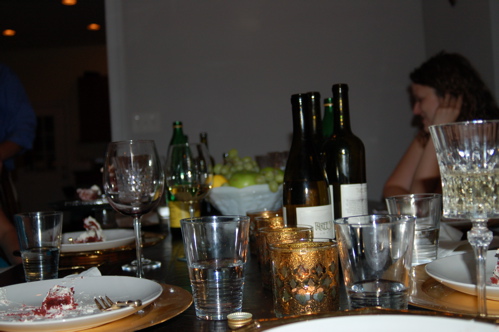
Find the location of a particular element. bottle of wine is located at coordinates (345, 146), (299, 127), (311, 121), (329, 131), (177, 137), (204, 139), (187, 139).